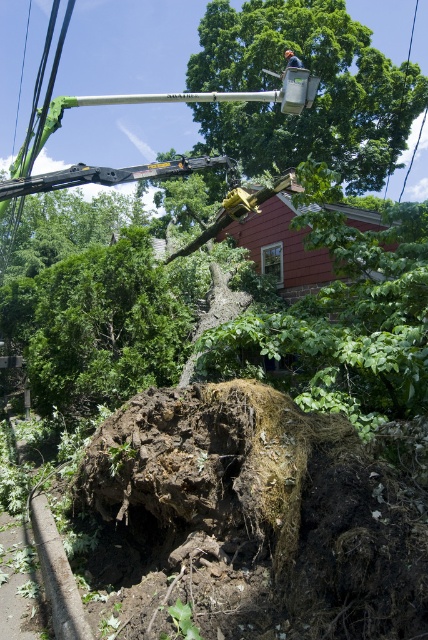
Based on the photo, does green leafy tree at lower left come in front of brushed metal helmet at upper center?

That is True.

Does green leafy tree at lower left have a lesser height compared to brushed metal helmet at upper center?

Yes, green leafy tree at lower left is shorter than brushed metal helmet at upper center.

What do you see at coordinates (104, 326) in the screenshot? The height and width of the screenshot is (640, 428). I see `green leafy tree at lower left` at bounding box center [104, 326].

I want to click on green leafy tree at lower left, so click(104, 326).

Consider the image. Is green leafy tree at upper center positioned behind brushed metal helmet at upper center?

Yes, it is.

Locate an element on the screen. green leafy tree at upper center is located at coordinates (317, 93).

Between point (386, 106) and point (291, 52), which one is positioned in front?

Point (291, 52) is in front.

This screenshot has width=428, height=640. In order to click on green leafy tree at upper center in this screenshot , I will do `click(317, 93)`.

Which of these two, green leafy tree at upper center or green leafy tree at lower left, stands shorter?

Standing shorter between the two is green leafy tree at lower left.

Does point (214, 22) lie behind point (53, 307)?

That is True.

Image resolution: width=428 pixels, height=640 pixels. Find the location of `green leafy tree at upper center`. green leafy tree at upper center is located at coordinates (317, 93).

Identify the location of green leafy tree at upper center. (317, 93).